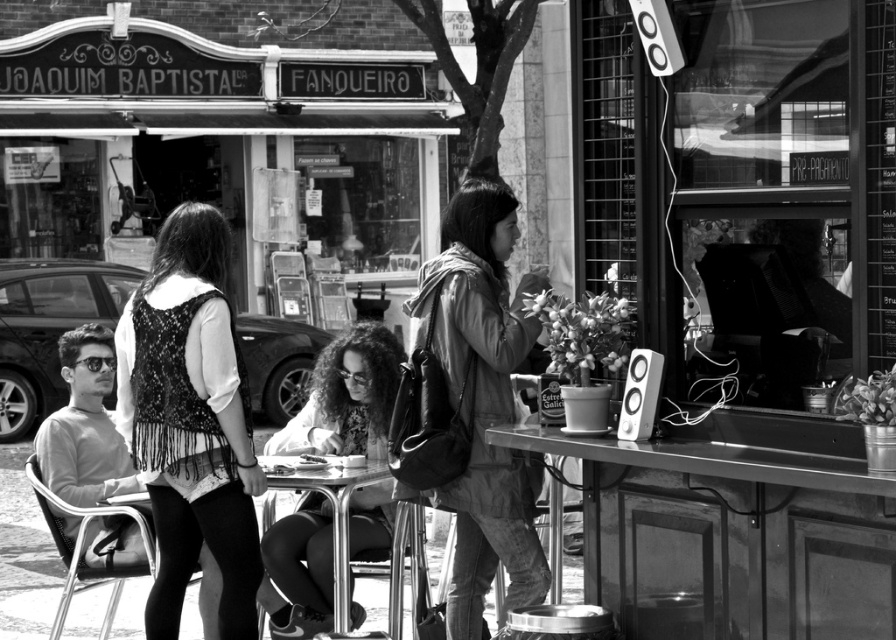
You are a customer at the cafe and you want to place your leather jacket at center on the metallic stainless steel table at lower right. Is the jacket currently positioned in a way that allows you to easily move it onto the table?

The leather jacket at center is positioned on the left side of the metallic stainless steel table at lower right, so it is already near the table and can be easily moved onto it.

You are trying to place a small potted plant between the leather jacket at center and the metallic stainless steel table at lower right. Can the space between them accommodate the plant?

The leather jacket at center occupies less space than the metallic stainless steel table at lower right, so there is sufficient space between them to place the small potted plant.